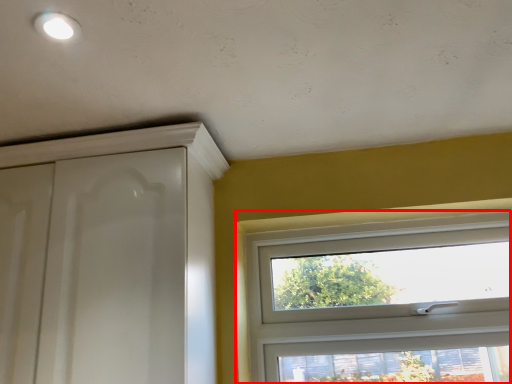
Question: From the image's perspective, what is the correct spatial positioning of window (annotated by the red box) in reference to screen door?

Choices:
 (A) below
 (B) above

Answer: (A)